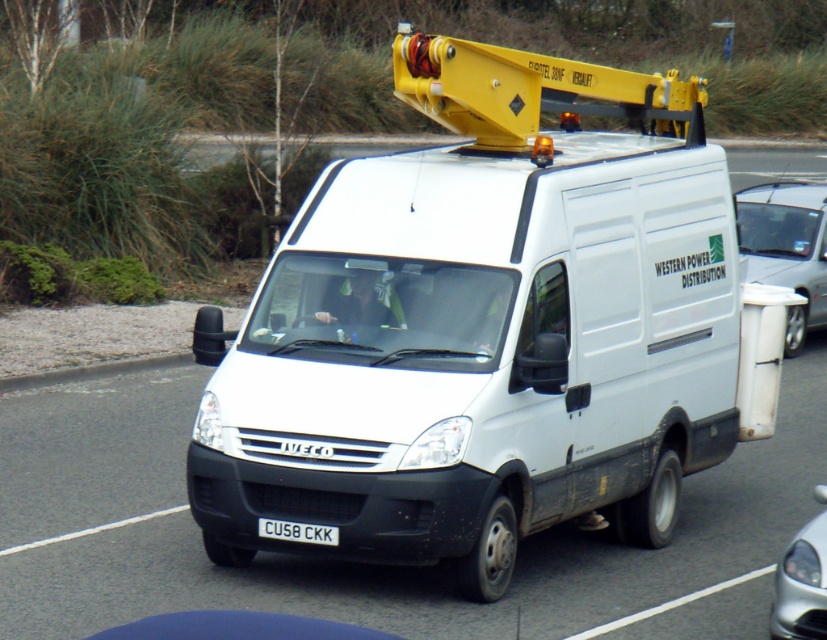
Who is more distant from viewer, (796, 570) or (330, 532)?

Positioned behind is point (330, 532).

Is white glossy car at center further to the viewer compared to white plastic license plate at center?

No, white glossy car at center is in front of white plastic license plate at center.

Between point (820, 636) and point (299, 525), which one is positioned in front?

Point (820, 636) is in front.

Where is `white glossy car at center`? Image resolution: width=827 pixels, height=640 pixels. white glossy car at center is located at coordinates (801, 586).

Is white plastic trash can at right above white glossy car at center?

Correct, white plastic trash can at right is located above white glossy car at center.

Who is more distant from viewer, [802,284] or [816,570]?

The point [802,284] is more distant.

Identify the location of white plastic trash can at right. This screenshot has height=640, width=827. (786, 248).

Between white matte van at center and white plastic license plate at center, which one appears on the right side from the viewer's perspective?

Positioned to the right is white matte van at center.

Does white matte van at center appear under white plastic license plate at center?

No, white matte van at center is not below white plastic license plate at center.

Does point (675, 390) come closer to viewer compared to point (271, 525)?

No, it is not.

At what (x,y) coordinates should I click in order to perform the action: click on white matte van at center. Please return your answer as a coordinate pair (x, y). The width and height of the screenshot is (827, 640). Looking at the image, I should click on (486, 328).